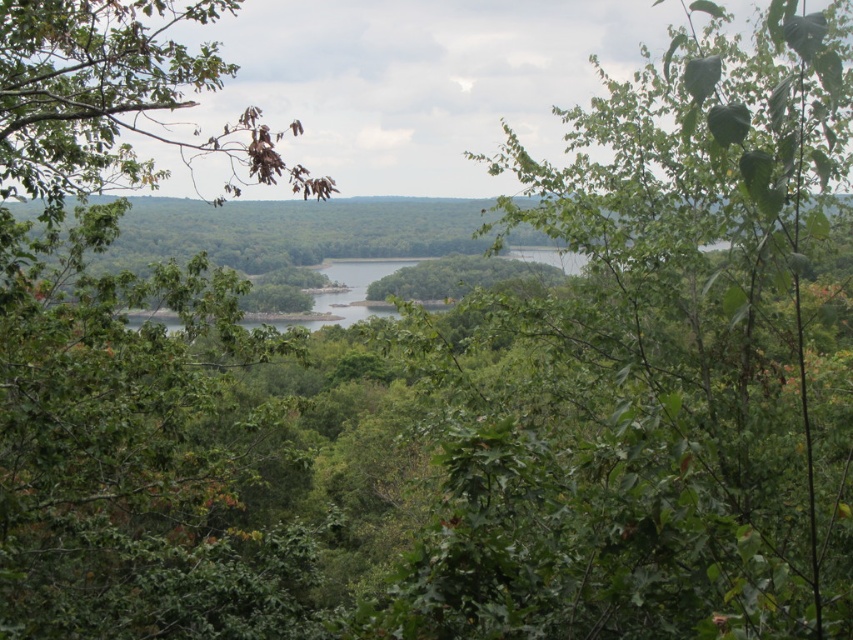
You are standing in the serene landscape and want to take a photo. There are two points of interest marked as point (711, 227) and point (144, 342). Which point is closer to your camera lens?

Point (711, 227) is closer to the camera than point (144, 342).

You are standing in the middle of the forest and see the green leafy tree at center and the green leafy tree at left. Which tree is taller?

The green leafy tree at left is taller than the green leafy tree at center.